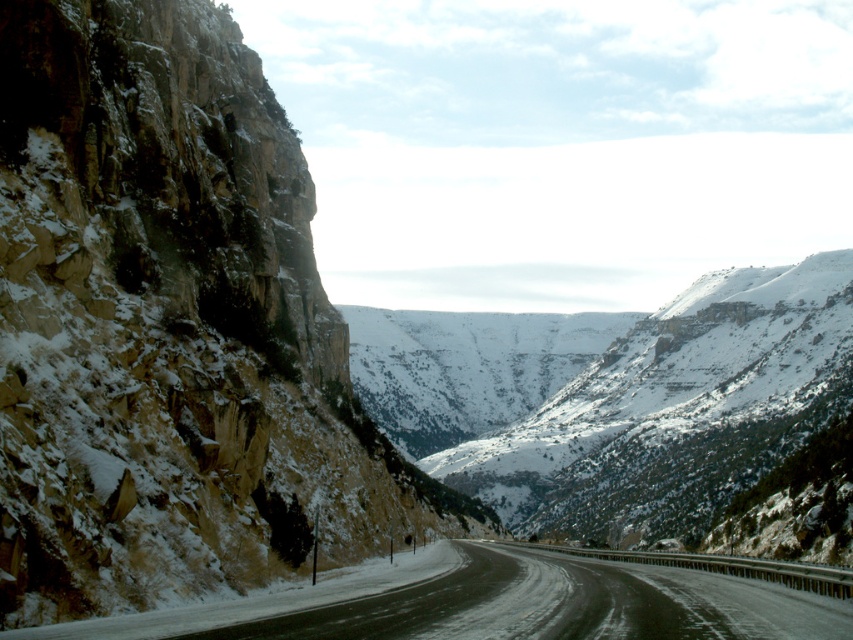
You are a hiker planning to cross the slick asphalt highway at center. There is a rugged stone cliff at left nearby. Which object is higher in elevation?

The rugged stone cliff at left is above the slick asphalt highway at center, so it has a higher elevation.

You are driving a delivery truck that is 2.5 meters wide. You need to navigate through the slick asphalt highway at center. The rugged stone cliff at left is adjacent to the road. Can your truck safely pass through the highway without hitting the cliff?

The rugged stone cliff at left is narrower than the slick asphalt highway at center. Since the cliff is narrower, the highway must be wider. Therefore, the truck can safely pass through the highway as its width is sufficient to accommodate the truck without hitting the cliff.

You are standing at the starting point of the road and want to reach the point marked as point (579, 628). There is an obstacle at point (125, 576). Will you encounter the obstacle before reaching your destination?

Point (125, 576) is further to the camera than point (579, 628). This means the obstacle at point (125, 576) is closer to your current position. Therefore, you will encounter the obstacle before reaching the destination point (579, 628).